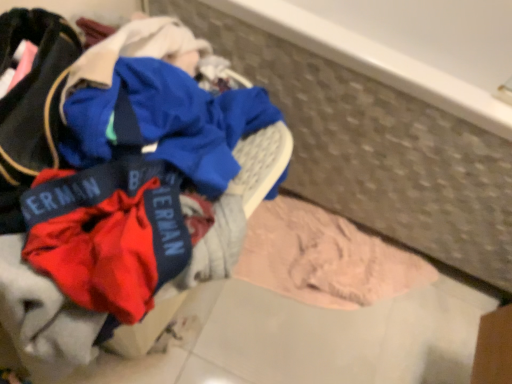
This screenshot has height=384, width=512. Find the location of `vacant area that is in front of pink soft fabric at lower right`. vacant area that is in front of pink soft fabric at lower right is located at coordinates (298, 357).